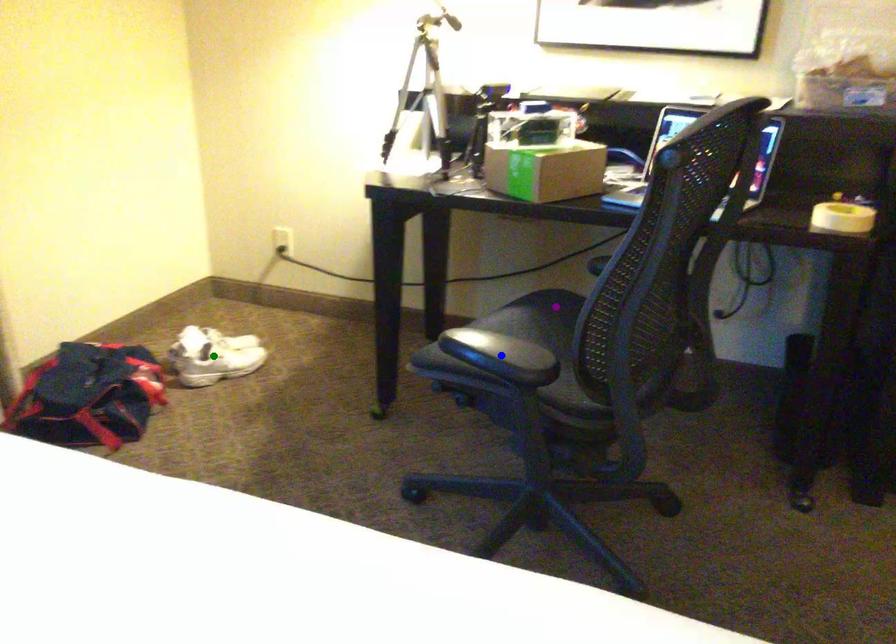
Order these from nearest to farthest:
purple point
green point
blue point

blue point < purple point < green point